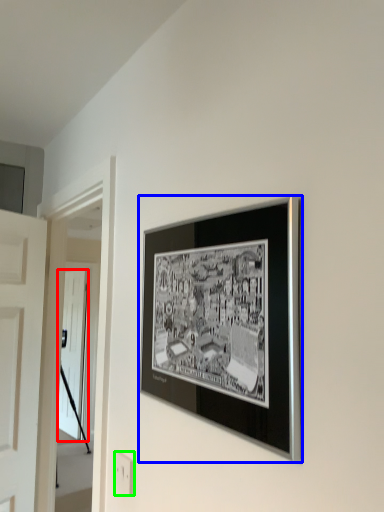
Question: Based on their relative distances, which object is nearer to door (highlighted by a red box)? Choose from picture frame (highlighted by a blue box) and electric outlet (highlighted by a green box).

Choices:
 (A) picture frame
 (B) electric outlet

Answer: (B)